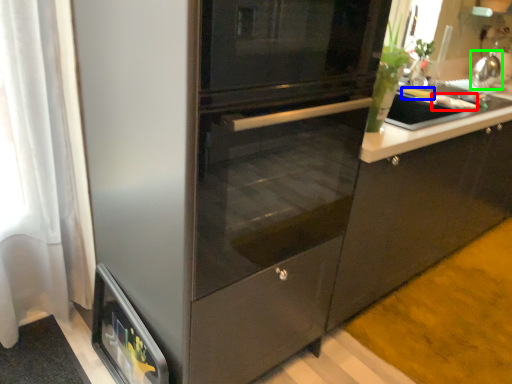
Question: Which object is the farthest from food (highlighted by a red box)? Choose among these: food (highlighted by a blue box) or kitchen appliance (highlighted by a green box).

Choices:
 (A) food
 (B) kitchen appliance

Answer: (B)